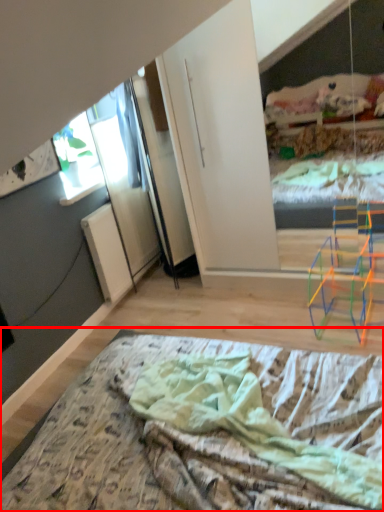
Question: Considering the relative positions of bed (annotated by the red box) and window in the image provided, where is bed (annotated by the red box) located with respect to the staircase?

Choices:
 (A) left
 (B) right

Answer: (B)